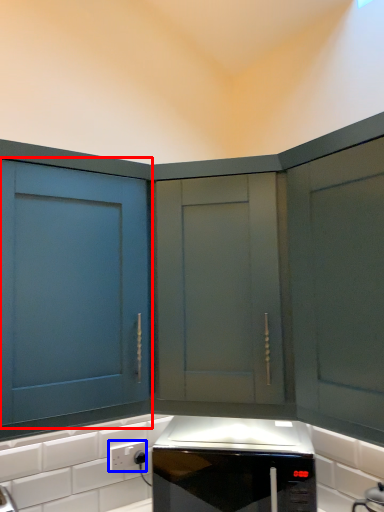
Question: Which of the following is the closest to the observer, cabinetry (highlighted by a red box) or electric outlet (highlighted by a blue box)?

Choices:
 (A) cabinetry
 (B) electric outlet

Answer: (A)